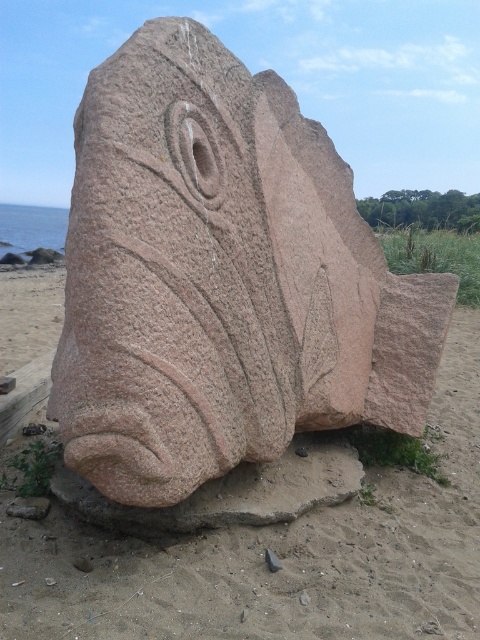
Can you confirm if pink granite fish at center is smaller than pink stone fish at center?

No.

Identify the location of pink granite fish at center. (222, 278).

Where is `pink granite fish at center`? The image size is (480, 640). pink granite fish at center is located at coordinates (222, 278).